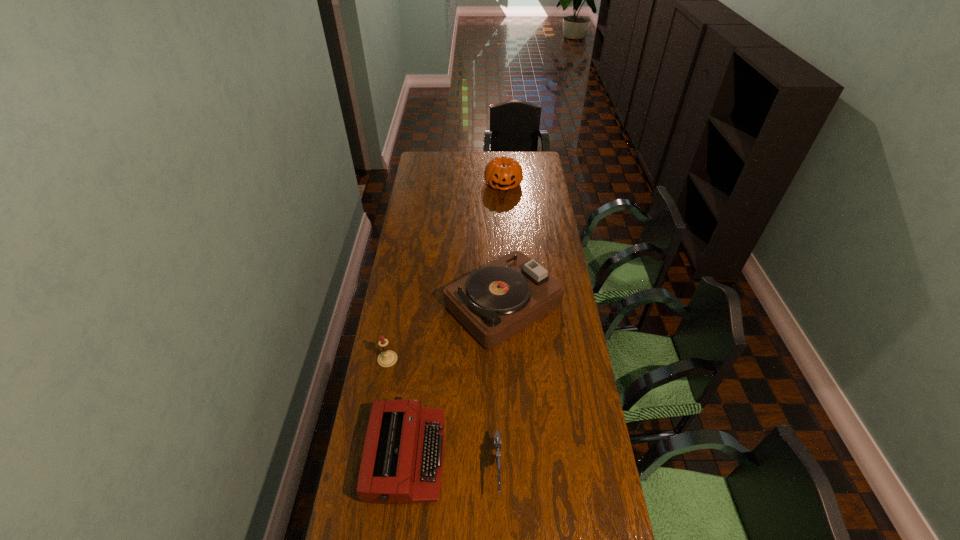
I want to click on free space between the gun and the record player, so click(x=500, y=387).

Where is `object that ranks as the third closest to the gun`? object that ranks as the third closest to the gun is located at coordinates click(x=387, y=358).

Locate which object ranks fourth in proximity to the typewriter. Please provide its 2D coordinates. Your answer should be formatted as a tuple, i.e. [(x, y)], where the tuple contains the x and y coordinates of a point satisfying the conditions above.

[(503, 173)]

This screenshot has width=960, height=540. I want to click on free space that satisfies the following two spatial constraints: 1. on the carved face of the farthest object; 2. on the typing side of the typewriter, so click(521, 456).